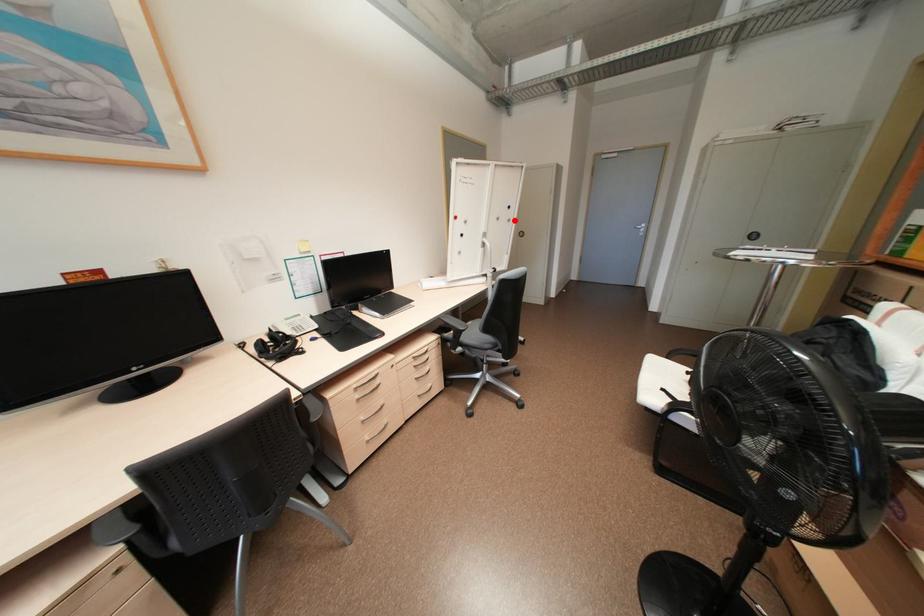
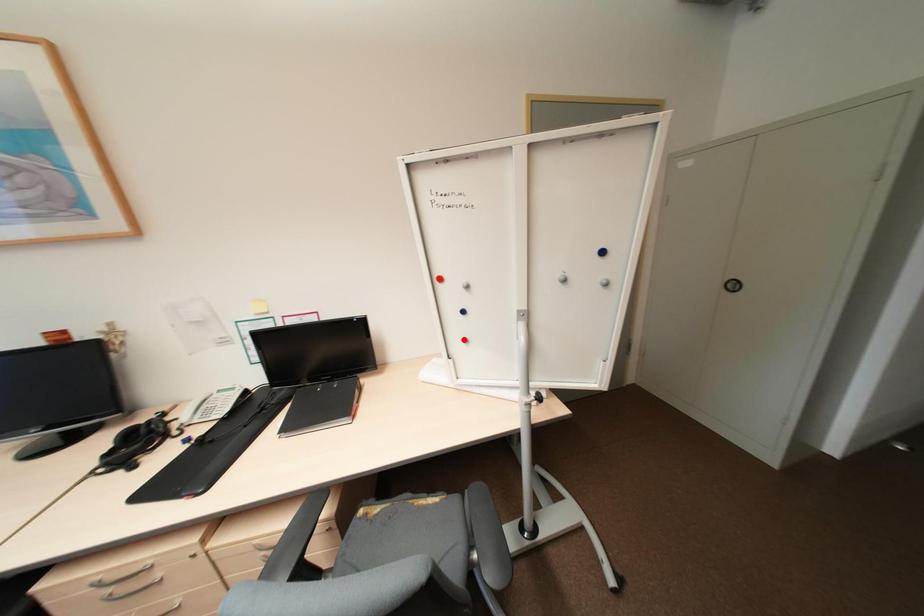
I am providing you with two images of the same scene from different viewpoints. A red point is marked on the first image and another point is marked on the second image. Does the point marked in image1 correspond to the same location as the one in image2?

No